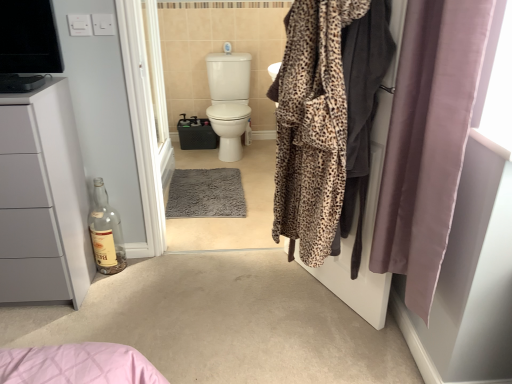
I want to click on free space in front of clear glass bottle at lower left, so click(x=108, y=288).